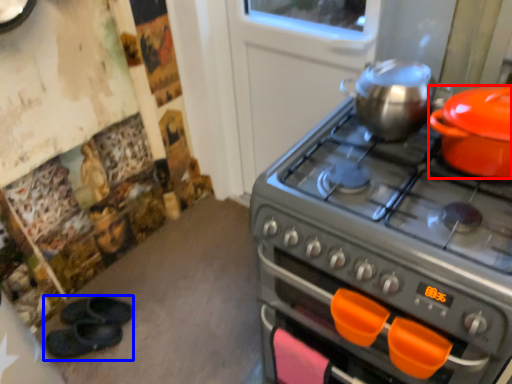
Question: Which of the following is the closest to the observer, kitchen appliance (highlighted by a red box) or footwear (highlighted by a blue box)?

Choices:
 (A) kitchen appliance
 (B) footwear

Answer: (A)